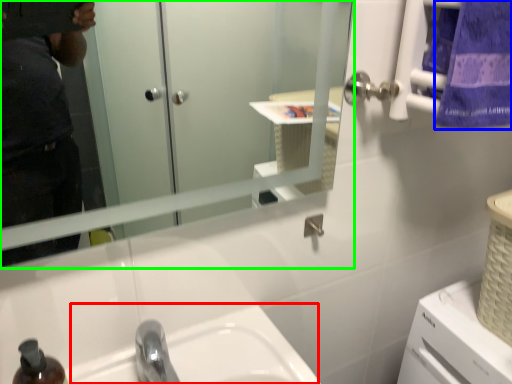
Question: Considering the real-world distances, which object is farthest from sink (highlighted by a red box)? towel/napkin (highlighted by a blue box) or mirror (highlighted by a green box)?

Choices:
 (A) towel/napkin
 (B) mirror

Answer: (A)